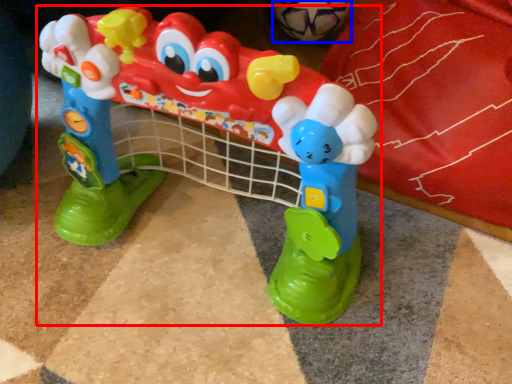
Question: Which object is further to the camera taking this photo, toy (highlighted by a red box) or toy (highlighted by a blue box)?

Choices:
 (A) toy
 (B) toy

Answer: (B)